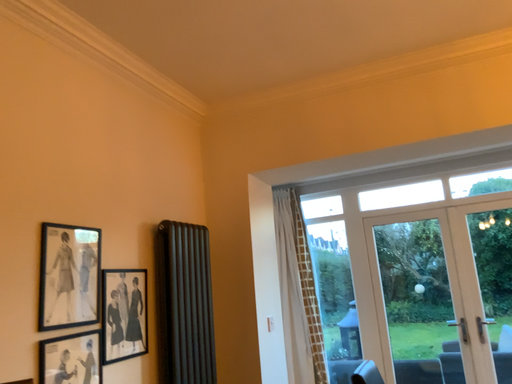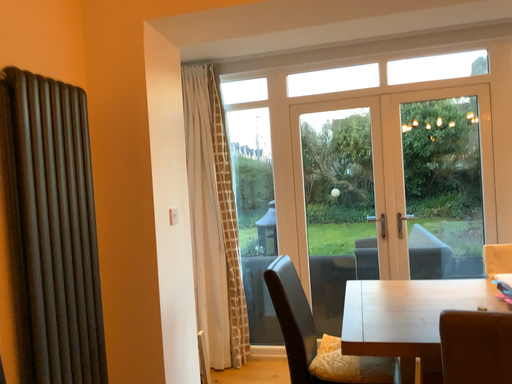
Question: Which way did the camera rotate in the video?

Choices:
 (A) rotated left
 (B) rotated right

Answer: (B)